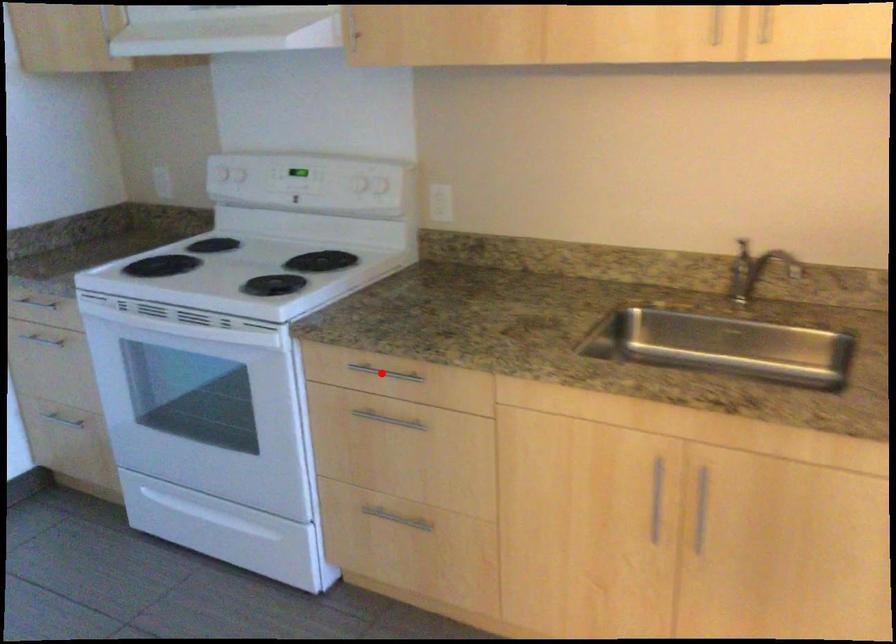
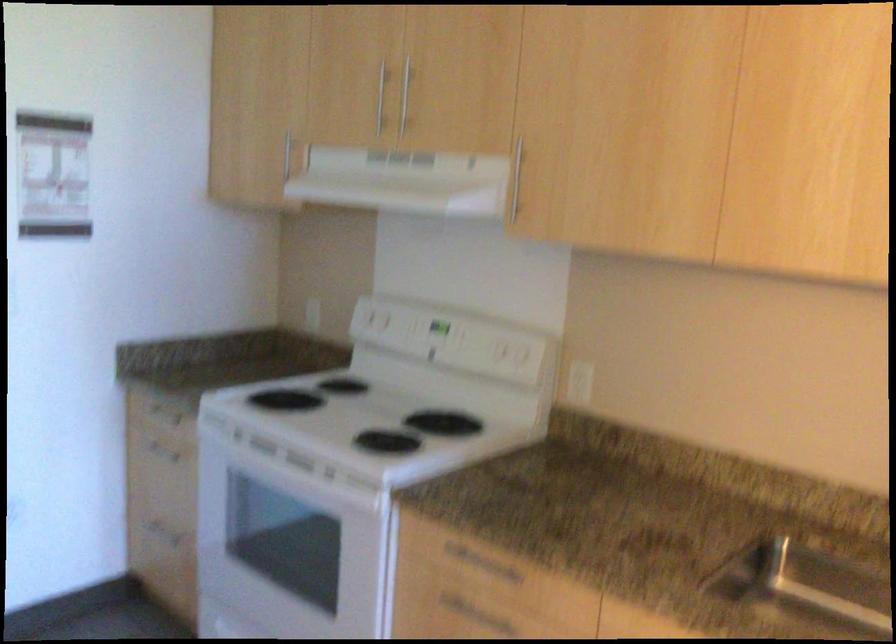
In the second image, find the point that corresponds to the highlighted location in the first image.

(480, 564)